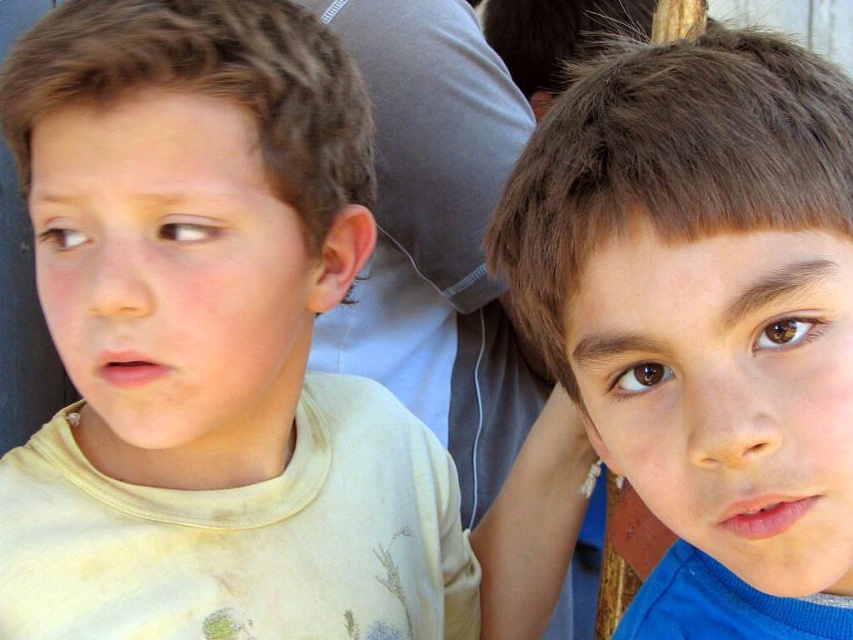
Can you confirm if brown hair at upper right is shorter than yellow cotton shirt at left?

Yes, brown hair at upper right is shorter than yellow cotton shirt at left.

What do you see at coordinates (703, 292) in the screenshot? The width and height of the screenshot is (853, 640). I see `brown hair at upper right` at bounding box center [703, 292].

Which is behind, point (685, 248) or point (361, 147)?

The point (361, 147) is behind.

The width and height of the screenshot is (853, 640). Identify the location of brown hair at upper right. (703, 292).